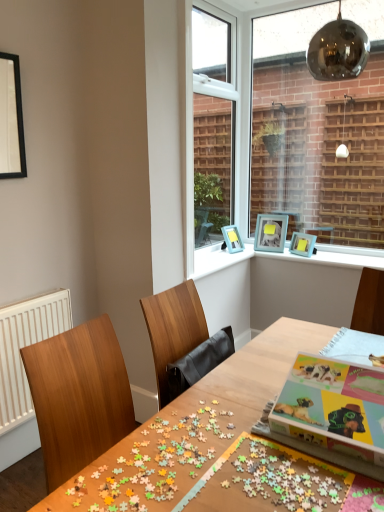
What do you see at coordinates (232, 239) in the screenshot?
I see `teal matte picture frame at upper right, positioned as the 3th picture frame in front-to-back order` at bounding box center [232, 239].

You are a GUI agent. You are given a task and a screenshot of the screen. Output one action in this format:
    pyautogui.click(x=<x>, y=<y>)
    Task: Click on the blue plastic picture frames at upper center
    This screenshot has width=384, height=512.
    Given the screenshot: What is the action you would take?
    pyautogui.click(x=287, y=257)

Image resolution: width=384 pixels, height=512 pixels. Describe the element at coordinates (302, 244) in the screenshot. I see `blue plastic picture frame at upper right, the 3th picture frame positioned from the back` at that location.

What is the approximate width of blue plastic picture frame at upper right, the 2th picture frame viewed from the front?

The width of blue plastic picture frame at upper right, the 2th picture frame viewed from the front, is 12.66 centimeters.

This screenshot has width=384, height=512. Describe the element at coordinates (333, 407) in the screenshot. I see `multicolored cardboard jigsaw puzzle at center` at that location.

What do you see at coordinates (270, 232) in the screenshot?
I see `teal matte picture frame at upper right, arranged as the third picture frame when viewed from the left` at bounding box center [270, 232].

Find the location of a particular element. Image resolution: width=384 pixels, height=512 pixels. teal matte picture frame at upper right, the 3th picture frame when ordered from right to left is located at coordinates (232, 239).

How much distance is there between metallic glass window at upper right and wooden table at center?

They are 2.11 meters apart.

From the image's perspective, is metallic glass window at upper right positioned above or below wooden table at center?

metallic glass window at upper right is above wooden table at center.

Is point (224, 16) in front of point (215, 368)?

No, it is behind (215, 368).

What's the angular difference between metallic glass window at upper right and wooden table at center's facing directions?

The angular difference between metallic glass window at upper right and wooden table at center is 0.423 degrees.

Based on the photo, is blue plastic picture frames at upper center next to white radiator at left?

blue plastic picture frames at upper center and white radiator at left are clearly separated.

Would you say blue plastic picture frames at upper center is to the left or to the right of white radiator at left in the picture?

blue plastic picture frames at upper center is to the right of white radiator at left.

Is blue plastic picture frames at upper center completely or partially outside of white radiator at left?

Yes, blue plastic picture frames at upper center is not within white radiator at left.

Could you tell me if blue plastic picture frames at upper center is facing white radiator at left?

No, blue plastic picture frames at upper center does not turn towards white radiator at left.

Visually, is blue plastic picture frames at upper center positioned to the left or to the right of multicolored puzzle pieces at center?

From the image, it's evident that blue plastic picture frames at upper center is to the right of multicolored puzzle pieces at center.

Identify the location of board game below the blue plastic picture frames at upper center (from the image's perspective). Image resolution: width=384 pixels, height=512 pixels. (209, 473).

Does blue plastic picture frames at upper center come in front of multicolored puzzle pieces at center?

No, blue plastic picture frames at upper center is behind multicolored puzzle pieces at center.

Which object is thinner, multicolored puzzle pieces at center or blue plastic picture frame at upper right, the 2th picture frame viewed from the front?

Thinner between the two is blue plastic picture frame at upper right, the 2th picture frame viewed from the front.

Which of these two, multicolored puzzle pieces at center or blue plastic picture frame at upper right, which is counted as the first picture frame, starting from the right, is bigger?

blue plastic picture frame at upper right, which is counted as the first picture frame, starting from the right, is bigger.

Is multicolored puzzle pieces at center positioned in front of blue plastic picture frame at upper right, the 2th picture frame viewed from the front?

That is True.

Considering the relative positions of multicolored puzzle pieces at center and blue plastic picture frame at upper right, the 3th picture frame positioned from the back, in the image provided, is multicolored puzzle pieces at center to the left of blue plastic picture frame at upper right, the 3th picture frame positioned from the back, from the viewer's perspective?

Correct, you'll find multicolored puzzle pieces at center to the left of blue plastic picture frame at upper right, the 3th picture frame positioned from the back.

From the image's perspective, who appears lower, white radiator at left or metallic glass window at upper right?

white radiator at left.

Find the location of a particular element. The width and height of the screenshot is (384, 512). radiator in front of the metallic glass window at upper right is located at coordinates pos(24,346).

Can you tell me how much white radiator at left and metallic glass window at upper right differ in facing direction?

88.7 degrees separate the facing orientations of white radiator at left and metallic glass window at upper right.

Is white radiator at left aimed at metallic glass window at upper right?

No, white radiator at left is not facing towards metallic glass window at upper right.

Are wooden table at center and teal matte picture frame at upper right, which appears as the fourth picture frame when viewed from the front, beside each other?

No, wooden table at center is not making contact with teal matte picture frame at upper right, which appears as the fourth picture frame when viewed from the front.

Considering the relative sizes of wooden table at center and teal matte picture frame at upper right, which appears as the fourth picture frame when viewed from the front, in the image provided, is wooden table at center taller than teal matte picture frame at upper right, which appears as the fourth picture frame when viewed from the front,?

Yes, wooden table at center is taller than teal matte picture frame at upper right, which appears as the fourth picture frame when viewed from the front.

Where is `the 3rd picture frame located above the wooden table at center (from a real-world perspective)`? Image resolution: width=384 pixels, height=512 pixels. the 3rd picture frame located above the wooden table at center (from a real-world perspective) is located at coordinates (270, 232).

Based on their sizes in the image, would you say wooden table at center is bigger or smaller than teal matte picture frame at upper right, the 1th picture frame from the back?

Considering their sizes, wooden table at center takes up more space than teal matte picture frame at upper right, the 1th picture frame from the back.

What's the angular difference between wooden table at center and metallic glass window at upper right's facing directions?

The facing directions of wooden table at center and metallic glass window at upper right are 0.423 degrees apart.

Does wooden table at center have a lesser height compared to metallic glass window at upper right?

Correct, wooden table at center is not as tall as metallic glass window at upper right.

How distant is wooden table at center from metallic glass window at upper right?

6.94 feet.

From a real-world perspective, is wooden table at center above or below metallic glass window at upper right?

wooden table at center is below metallic glass window at upper right.

You are a GUI agent. You are given a task and a screenshot of the screen. Output one action in this format:
    pyautogui.click(x=<x>, y=<y>)
    Task: Click on the window that is above the wooden table at center (from the image's perspective)
    This screenshot has width=384, height=512.
    Given the screenshot: What is the action you would take?
    pyautogui.click(x=236, y=118)

The width and height of the screenshot is (384, 512). Find the location of `window sill above the white radiator at left (from a real-world perspective)`. window sill above the white radiator at left (from a real-world perspective) is located at coordinates (287, 257).

Estimate the real-world distances between objects in this image. Which object is closer to blue plastic picture frame at upper right, the 3th picture frame positioned from the back, teal matte picture frame at upper right, the 1th picture frame from the back, or multicolored puzzle pieces at center?

teal matte picture frame at upper right, the 1th picture frame from the back, is closer to blue plastic picture frame at upper right, the 3th picture frame positioned from the back.

Based on their spatial positions, is teal matte picture frame at upper right, arranged as the third picture frame when viewed from the left, or blue plastic picture frame at upper right, which is counted as the first picture frame, starting from the right, further from white radiator at left?

blue plastic picture frame at upper right, which is counted as the first picture frame, starting from the right, is positioned further to the anchor white radiator at left.

Estimate the real-world distances between objects in this image. Which object is closer to blue plastic picture frame at upper right, which is counted as the first picture frame, starting from the right, multicolored puzzle pieces at center or teal matte picture frame at upper right, which ranks as the second picture frame in left-to-right order?

teal matte picture frame at upper right, which ranks as the second picture frame in left-to-right order.

When comparing their distances from blue plastic picture frame at upper right, the 2th picture frame viewed from the front, does blue plastic picture frames at upper center or white radiator at left seem closer?

Among the two, blue plastic picture frames at upper center is located nearer to blue plastic picture frame at upper right, the 2th picture frame viewed from the front.

From the image, which object appears to be farther from blue plastic picture frames at upper center, black matte picture frame at upper left, which is counted as the first picture frame, starting from the left, or blue plastic picture frame at upper right, the 3th picture frame positioned from the back?

black matte picture frame at upper left, which is counted as the first picture frame, starting from the left, lies further to blue plastic picture frames at upper center than the other object.

From the picture: Based on their spatial positions, is multicolored puzzle pieces at center or multicolored cardboard jigsaw puzzle at center further from white plastic window frame at upper center?

multicolored puzzle pieces at center lies further to white plastic window frame at upper center than the other object.

When comparing their distances from white radiator at left, does multicolored cardboard jigsaw puzzle at center or multicolored puzzle pieces at center seem closer?

The object closer to white radiator at left is multicolored puzzle pieces at center.

Considering their positions, is blue plastic picture frames at upper center positioned further to white plastic window frame at upper center than multicolored puzzle pieces at center?

Based on the image, multicolored puzzle pieces at center appears to be further to white plastic window frame at upper center.

The width and height of the screenshot is (384, 512). I want to click on window positioned between wooden table at center and white plastic window frame at upper center from near to far, so click(x=236, y=118).

The image size is (384, 512). What are the coordinates of `picture frame positioned between multicolored cardboard jigsaw puzzle at center and blue plastic picture frame at upper right, placed as the 4th picture frame when sorted from left to right, from near to far` in the screenshot? It's located at (11, 119).

In order to click on jigsaw puzzle located between wooden table at center and blue plastic picture frame at upper right, the 2th picture frame viewed from the front, in the depth direction in this screenshot , I will do `click(333, 407)`.

Locate an element on the screen. window frame situated between white radiator at left and blue plastic picture frame at upper right, the 3th picture frame positioned from the back, from left to right is located at coordinates (204, 111).